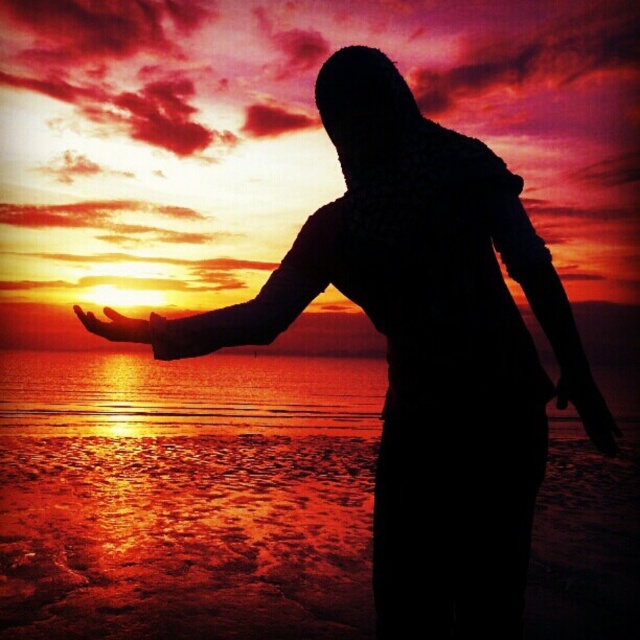
Question: Which object appears closest to the camera in this image?

Choices:
 (A) black matte hand at lower right
 (B) matte orange hand at lower left

Answer: (A)

Question: Is shiny reflective water at center in front of black matte hand at lower right?

Choices:
 (A) yes
 (B) no

Answer: (B)

Question: Does shiny reflective water at center appear on the right side of matte black arm at center?

Choices:
 (A) yes
 (B) no

Answer: (B)

Question: Which object is positioned closest to the matte black arm at center?

Choices:
 (A) matte orange hand at lower left
 (B) black matte hand at lower right
 (C) shiny reflective water at center

Answer: (A)

Question: Which point appears farthest from the camera in this image?

Choices:
 (A) pyautogui.click(x=148, y=330)
 (B) pyautogui.click(x=602, y=424)

Answer: (A)

Question: Is shiny reflective water at center below matte black arm at center?

Choices:
 (A) no
 (B) yes

Answer: (B)